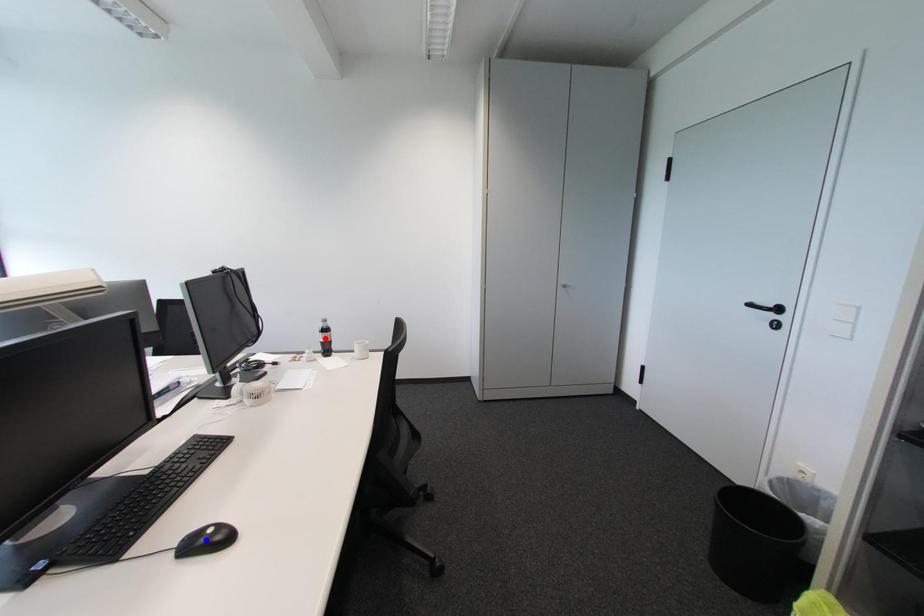
Question: Which of the two points in the image is closer to the camera?

Choices:
 (A) Blue point is closer.
 (B) Red point is closer.

Answer: (A)